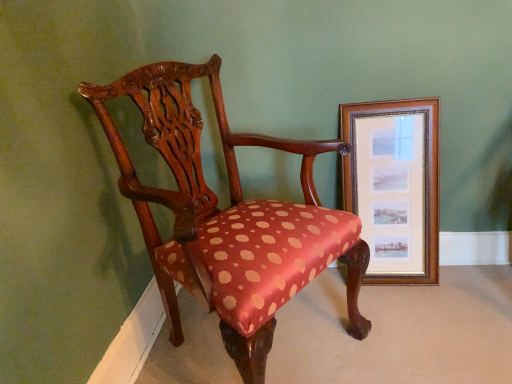
Find the location of a particular element. polished wood chair at center is located at coordinates (228, 217).

Describe the element at coordinates (228, 217) in the screenshot. The height and width of the screenshot is (384, 512). I see `polished wood chair at center` at that location.

The width and height of the screenshot is (512, 384). Describe the element at coordinates (394, 186) in the screenshot. I see `wooden frame at right` at that location.

You are a GUI agent. You are given a task and a screenshot of the screen. Output one action in this format:
    pyautogui.click(x=<x>, y=<y>)
    Task: Click on the wooden frame at right
    
    Given the screenshot: What is the action you would take?
    pyautogui.click(x=394, y=186)

You are a GUI agent. You are given a task and a screenshot of the screen. Output one action in this format:
    pyautogui.click(x=<x>, y=<y>)
    Task: Click on the polished wood chair at center
    
    Given the screenshot: What is the action you would take?
    pyautogui.click(x=228, y=217)

Considering the positions of objects polished wood chair at center and wooden frame at right in the image provided, who is more to the right, polished wood chair at center or wooden frame at right?

From the viewer's perspective, wooden frame at right appears more on the right side.

Is the depth of polished wood chair at center greater than that of wooden frame at right?

No, the depth of polished wood chair at center is less than that of wooden frame at right.

Does point (103, 100) come behind point (399, 169)?

No, (103, 100) is closer to viewer.

From the image's perspective, between polished wood chair at center and wooden frame at right, which one is located above?

wooden frame at right appears higher in the image.

From a real-world perspective, between polished wood chair at center and wooden frame at right, who is vertically higher?

polished wood chair at center.

Considering the relative sizes of polished wood chair at center and wooden frame at right in the image provided, is polished wood chair at center thinner than wooden frame at right?

No.

Between polished wood chair at center and wooden frame at right, which one has more height?

polished wood chair at center.

Does polished wood chair at center have a smaller size compared to wooden frame at right?

Actually, polished wood chair at center might be larger than wooden frame at right.

Is polished wood chair at center not within wooden frame at right?

Absolutely, polished wood chair at center is external to wooden frame at right.

Is polished wood chair at center next to wooden frame at right?

There is a gap between polished wood chair at center and wooden frame at right.

Is polished wood chair at center oriented towards wooden frame at right?

No.

What's the angular difference between polished wood chair at center and wooden frame at right's facing directions?

polished wood chair at center and wooden frame at right are facing 57.6 degrees away from each other.

You are a GUI agent. You are given a task and a screenshot of the screen. Output one action in this format:
    pyautogui.click(x=<x>, y=<y>)
    Task: Click on the chair in front of the wooden frame at right
    
    Given the screenshot: What is the action you would take?
    pyautogui.click(x=228, y=217)

Looking at this image, considering the relative positions of wooden frame at right and polished wood chair at center in the image provided, is wooden frame at right to the left or to the right of polished wood chair at center?

Based on their positions, wooden frame at right is located to the right of polished wood chair at center.

Considering their positions, is wooden frame at right located in front of or behind polished wood chair at center?

In the image, wooden frame at right appears behind polished wood chair at center.

Is point (416, 260) less distant than point (149, 241)?

No.

From the image's perspective, which is above, wooden frame at right or polished wood chair at center?

From the image's view, wooden frame at right is above.

From a real-world perspective, is wooden frame at right located higher than polished wood chair at center?

No, from a real-world perspective, wooden frame at right is not on top of polished wood chair at center.

Considering the sizes of objects wooden frame at right and polished wood chair at center in the image provided, who is wider, wooden frame at right or polished wood chair at center?

Wider between the two is polished wood chair at center.

Is wooden frame at right shorter than polished wood chair at center?

Correct, wooden frame at right is not as tall as polished wood chair at center.

Does wooden frame at right have a larger size compared to polished wood chair at center?

Actually, wooden frame at right might be smaller than polished wood chair at center.

Is wooden frame at right spatially inside polished wood chair at center, or outside of it?

wooden frame at right lies outside polished wood chair at center.

Are wooden frame at right and polished wood chair at center located far from each other?

Actually, wooden frame at right and polished wood chair at center are a little close together.

Is wooden frame at right oriented towards polished wood chair at center?

No.

Locate an element on the screen. This screenshot has height=384, width=512. chair on the left of wooden frame at right is located at coordinates (228, 217).

Where is `chair located below the wooden frame at right (from the image's perspective)`? The image size is (512, 384). chair located below the wooden frame at right (from the image's perspective) is located at coordinates (228, 217).

Locate an element on the screen. Image resolution: width=512 pixels, height=384 pixels. chair above the wooden frame at right (from a real-world perspective) is located at coordinates (228, 217).